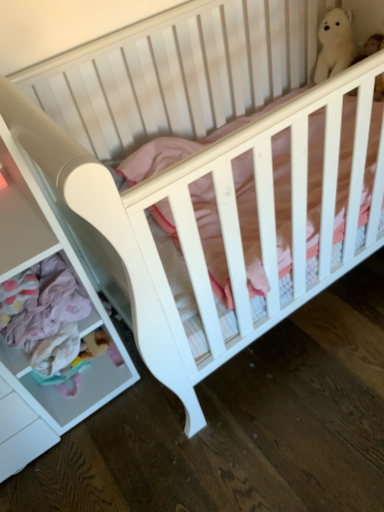
Question: Based on their sizes in the image, would you say white plush bear at upper right is bigger or smaller than white plastic drawer at lower left?

Choices:
 (A) big
 (B) small

Answer: (B)

Question: Is point (329, 72) positioned closer to the camera than point (1, 169)?

Choices:
 (A) closer
 (B) farther

Answer: (B)

Question: From the image's perspective, relative to white plastic drawer at lower left, is white plush bear at upper right above or below?

Choices:
 (A) above
 (B) below

Answer: (A)

Question: Looking at the image, does white plastic drawer at lower left seem bigger or smaller compared to white plush bear at upper right?

Choices:
 (A) big
 (B) small

Answer: (A)

Question: From the image's perspective, is white plastic drawer at lower left positioned above or below white plush bear at upper right?

Choices:
 (A) below
 (B) above

Answer: (A)

Question: In terms of width, does white plastic drawer at lower left look wider or thinner when compared to white plush bear at upper right?

Choices:
 (A) thin
 (B) wide

Answer: (B)

Question: In the image, is white plastic drawer at lower left positioned in front of or behind white plush bear at upper right?

Choices:
 (A) front
 (B) behind

Answer: (A)